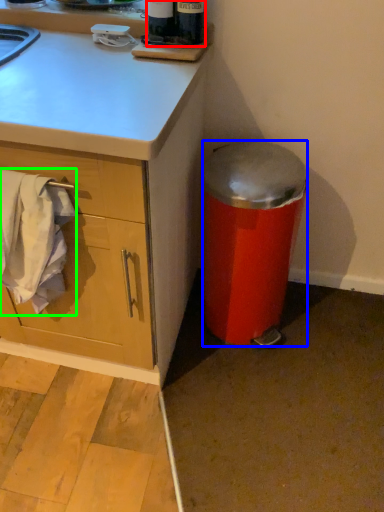
Question: Which object is the closest to the bottle (highlighted by a red box)? Choose among these: trash bin/can (highlighted by a blue box) or laundry (highlighted by a green box).

Choices:
 (A) trash bin/can
 (B) laundry

Answer: (A)